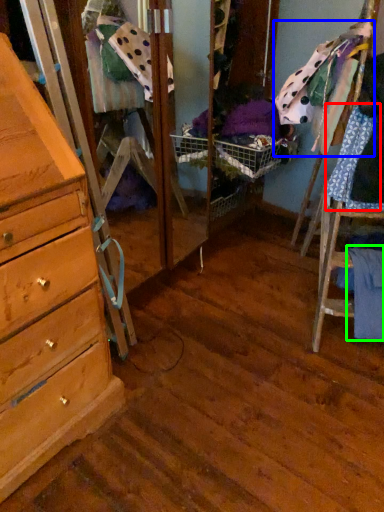
Question: Which object is the closest to the clothing (highlighted by a red box)? Choose among these: clothing (highlighted by a blue box) or clothing (highlighted by a green box).

Choices:
 (A) clothing
 (B) clothing

Answer: (A)